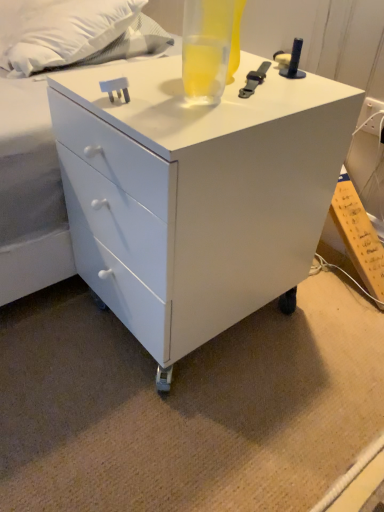
Question: In terms of width, does white soft pillow at upper left look wider or thinner when compared to translucent glass beverage at top?

Choices:
 (A) wide
 (B) thin

Answer: (A)

Question: Would you say white soft pillow at upper left is to the left or to the right of translucent glass beverage at top in the picture?

Choices:
 (A) right
 (B) left

Answer: (B)

Question: Which object is the closest to the translucent glass beverage at top?

Choices:
 (A) white soft pillow at upper left
 (B) white glossy chest of drawers at center

Answer: (B)

Question: Estimate the real-world distances between objects in this image. Which object is closer to the translucent glass beverage at top?

Choices:
 (A) white soft pillow at upper left
 (B) white glossy chest of drawers at center

Answer: (B)